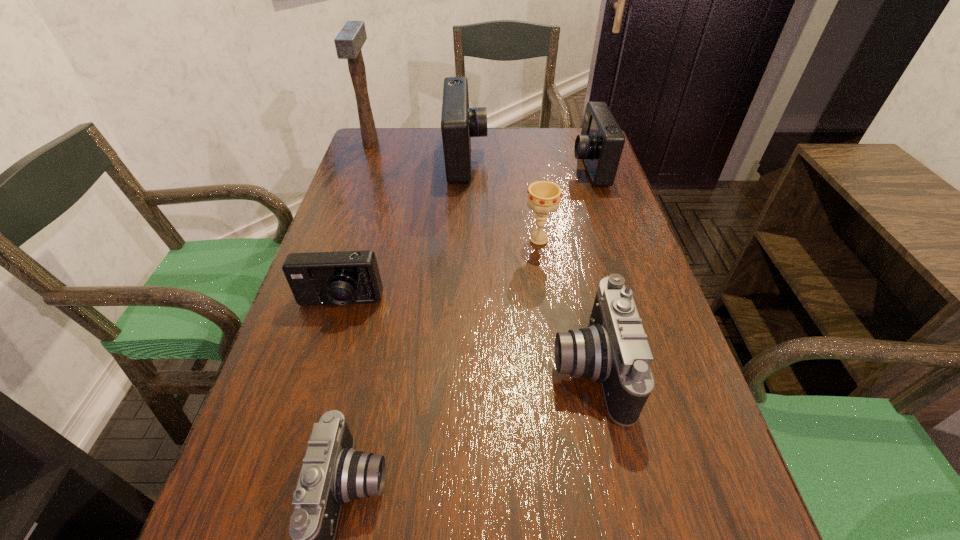
What are the coordinates of `blue camera that is the second closest to the third nearest camera` in the screenshot? It's located at (600, 145).

Where is `blank space that satisfies the following two spatial constraints: 1. on the front-facing side of the tallest camera; 2. on the back side of the chalice`? The width and height of the screenshot is (960, 540). blank space that satisfies the following two spatial constraints: 1. on the front-facing side of the tallest camera; 2. on the back side of the chalice is located at coordinates (463, 239).

I want to click on free spot that satisfies the following two spatial constraints: 1. on the front-facing side of the rightmost object; 2. on the front-facing side of the nearest blue camera, so click(x=633, y=303).

Where is `vacant space that satisfies the following two spatial constraints: 1. on the front-facing side of the fourth farthest object; 2. on the right side of the third camera from right to left`? vacant space that satisfies the following two spatial constraints: 1. on the front-facing side of the fourth farthest object; 2. on the right side of the third camera from right to left is located at coordinates (463, 239).